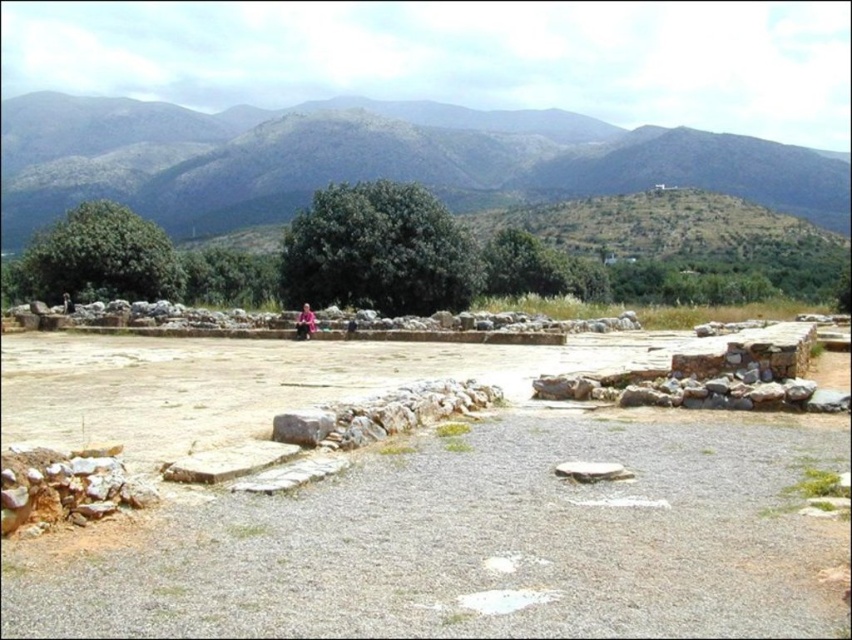
Question: Can you confirm if pink fabric person at center is positioned above dark blue fabric at center?

Choices:
 (A) no
 (B) yes

Answer: (B)

Question: Which of these objects is positioned farthest from the green leafy tree at center?

Choices:
 (A) green grassy hill at upper center
 (B) gray rough stone at center

Answer: (A)

Question: Which of the following is the closest to the observer?

Choices:
 (A) (311, 330)
 (B) (296, 417)
 (C) (64, 296)
 (D) (330, 275)

Answer: (B)

Question: Among these points, which one is farthest from the camera?

Choices:
 (A) (315, 420)
 (B) (346, 333)
 (C) (64, 298)
 (D) (61, 228)

Answer: (D)

Question: Can you confirm if gray rough stone at center is smaller than dark brown leather jacket at upper left?

Choices:
 (A) yes
 (B) no

Answer: (A)

Question: Is green leafy tree at upper left to the left of pink fabric person at center from the viewer's perspective?

Choices:
 (A) no
 (B) yes

Answer: (B)